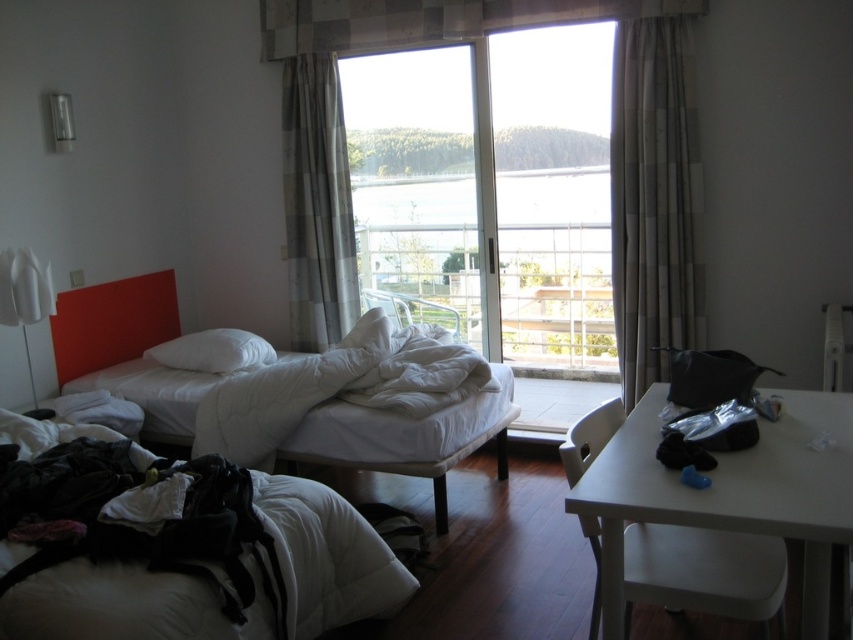
You are standing in the bedroom and want to reach both the point at coordinates (619, 291) and the point at coordinates (294, 173). Which point do you need to walk towards first to reach the closer one?

Point at coordinates (619, 291) is closer to you than point at coordinates (294, 173), so you should walk towards point at coordinates (619, 291) first.

You are standing in the bedroom and want to reach both the point at coordinates (396, 220) and the point at coordinates (669, 54). Which point will you reach first if you move straight towards them?

You will reach point (396, 220) first because it is closer to you than point (669, 54), which is further away.